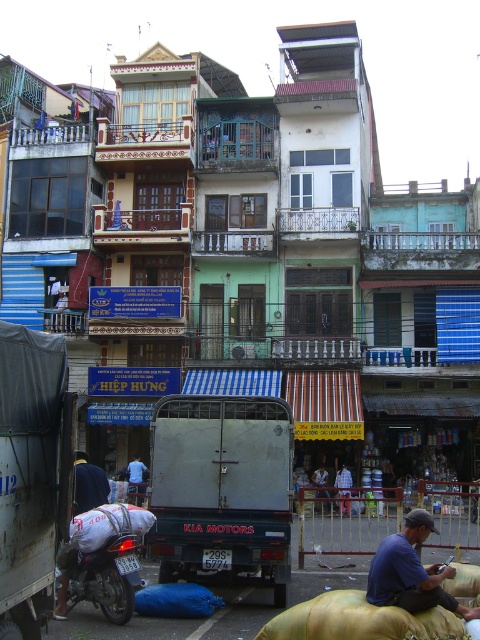
You are a customer in a clothing store looking at two shirts. The blue cotton shirt at lower right and the blue striped shirt at center. Which shirt is shorter in length?

The blue cotton shirt at lower right is shorter than the blue striped shirt at center.

Consider the image. You are a customer in a Southeast Asian clothing store and see both the blue cotton shirt at lower right and the blue striped shirt at center. Which shirt is positioned higher on the rack?

The blue cotton shirt at lower right is located above the blue striped shirt at center, so it is positioned higher on the rack.